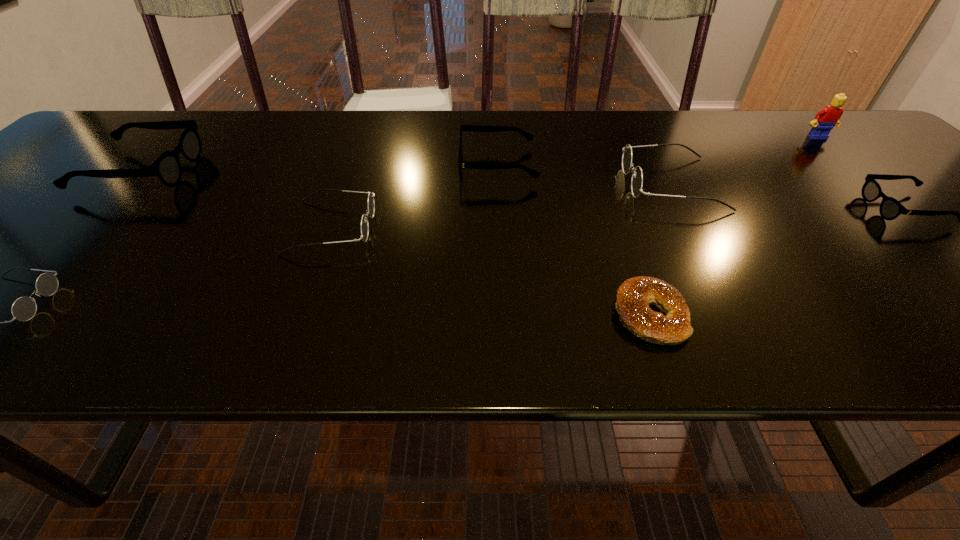
The height and width of the screenshot is (540, 960). I want to click on Lego, so click(827, 118).

Locate an element on the screen. This screenshot has width=960, height=540. the farthest object is located at coordinates (827, 118).

You are a GUI agent. You are given a task and a screenshot of the screen. Output one action in this format:
    pyautogui.click(x=<x>, y=<y>)
    Task: Click on the biggest black spectacles
    
    Given the screenshot: What is the action you would take?
    pyautogui.click(x=167, y=167)

The image size is (960, 540). Find the location of `the rightmost dark spectacles`. the rightmost dark spectacles is located at coordinates (637, 177).

I want to click on the fifth spectacles from left to right, so click(x=637, y=177).

Locate an element on the screen. The image size is (960, 540). the second black spectacles from left to right is located at coordinates (476, 128).

What are the coordinates of `the fourth object from left to right` in the screenshot? It's located at (476, 128).

Where is `the second smallest dark spectacles`? The width and height of the screenshot is (960, 540). the second smallest dark spectacles is located at coordinates (371, 204).

Identify the location of the second dark spectacles from right to left. The height and width of the screenshot is (540, 960). (371, 204).

Where is `the rightmost spectacles`? the rightmost spectacles is located at coordinates (890, 208).